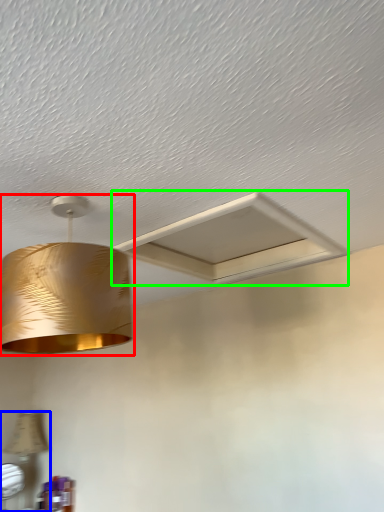
Question: Which object is the farthest from lamp (highlighted by a red box)? Choose among these: lamp (highlighted by a blue box) or exhaust hood (highlighted by a green box).

Choices:
 (A) lamp
 (B) exhaust hood

Answer: (A)